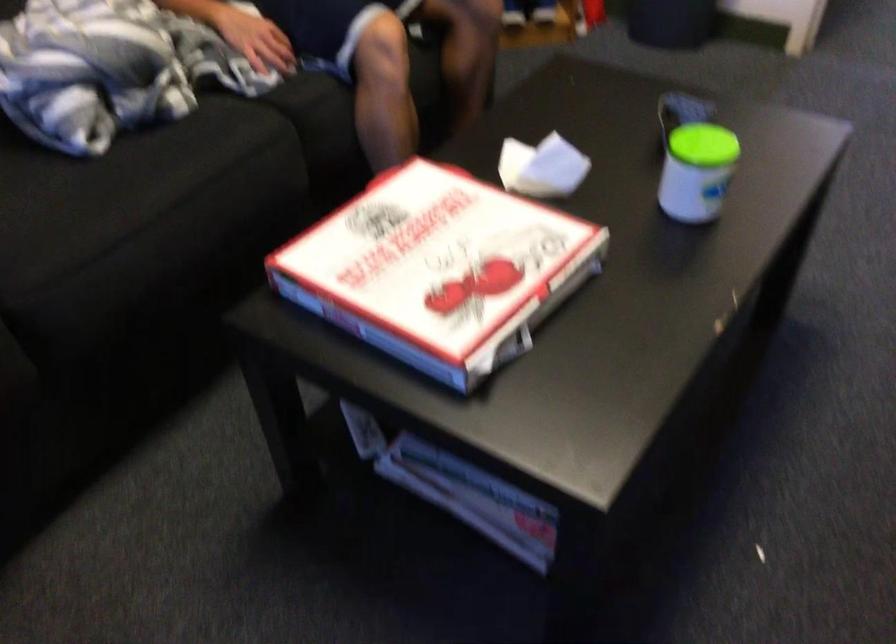
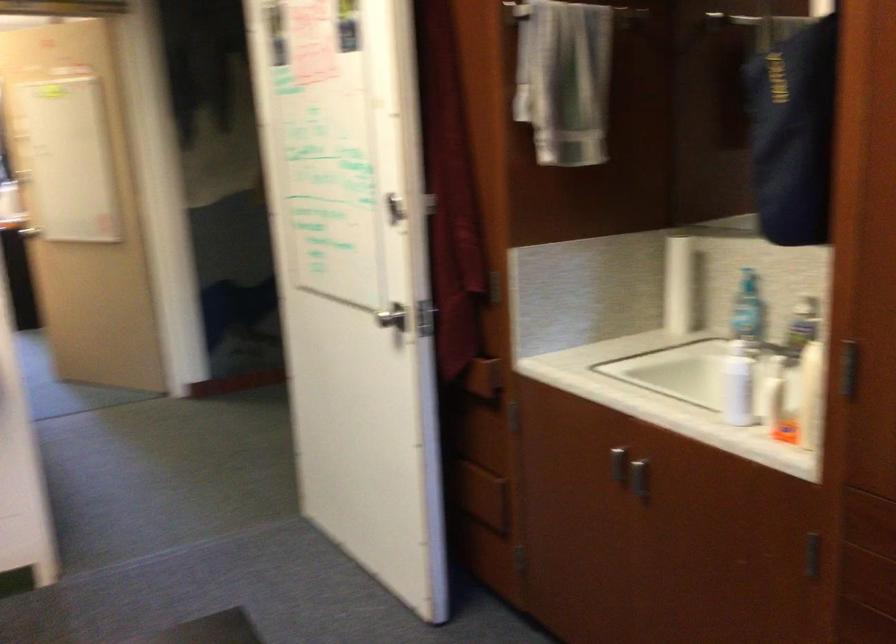
Question: The camera is either moving clockwise (left) or counter-clockwise (right) around the object. The first image is from the beginning of the video and the second image is from the end. Is the camera moving left or right when shooting the video?

Choices:
 (A) Left
 (B) Right

Answer: (A)